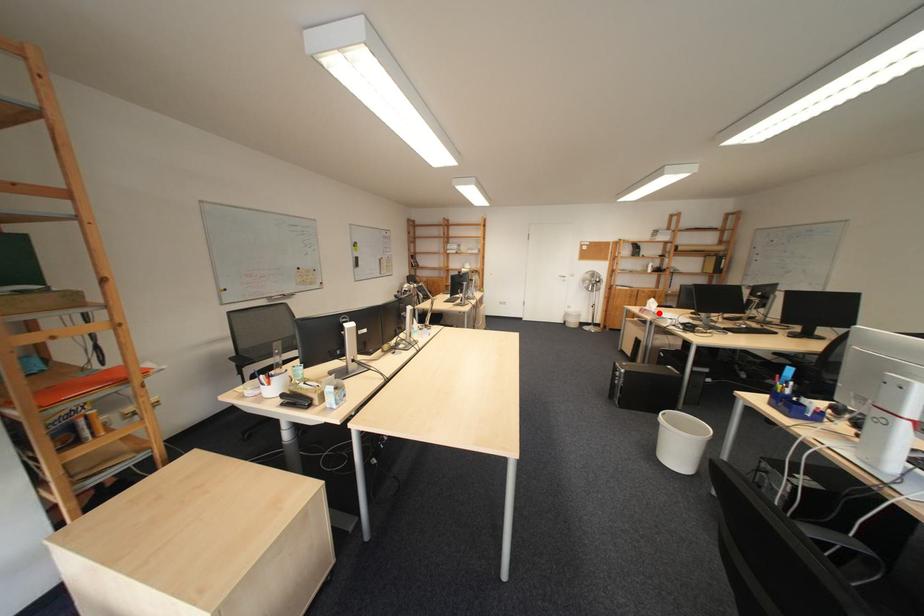
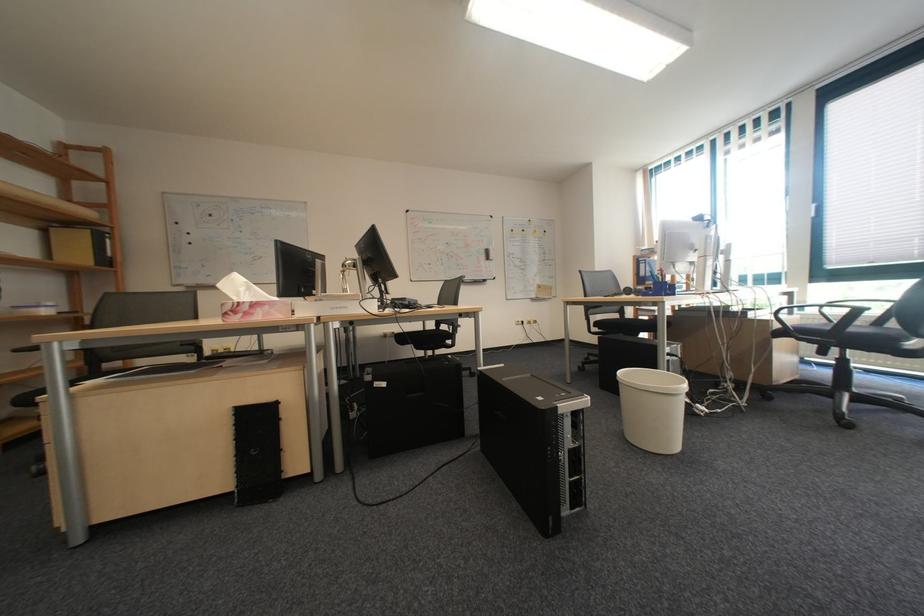
Where in the second image is the point corresponding to the highlighted location from the first image?

(273, 312)